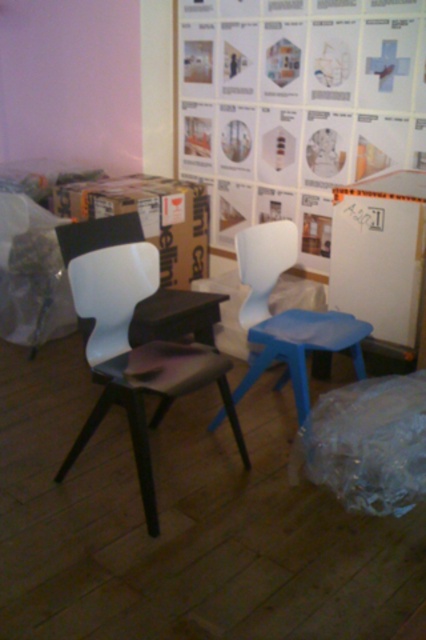
Question: Is the position of white paper at upper center less distant than that of white plastic chair at center?

Choices:
 (A) no
 (B) yes

Answer: (A)

Question: Considering the relative positions of white paperboard at upper center and cardboard box at center in the image provided, where is white paperboard at upper center located with respect to cardboard box at center?

Choices:
 (A) below
 (B) above

Answer: (A)

Question: Which of the following is the farthest from the observer?

Choices:
 (A) white paper at upper center
 (B) white plastic chair at center

Answer: (A)

Question: Which object is closer to the camera taking this photo?

Choices:
 (A) cardboard box at center
 (B) matte white chair at center
 (C) white paperboard at upper center
 (D) black matte table at center

Answer: (B)

Question: Does matte white chair at center appear on the right side of black matte table at center?

Choices:
 (A) yes
 (B) no

Answer: (A)

Question: Which of the following is the closest to the observer?

Choices:
 (A) click(282, 262)
 (B) click(150, 518)
 (C) click(226, 296)
 (D) click(408, 436)

Answer: (B)